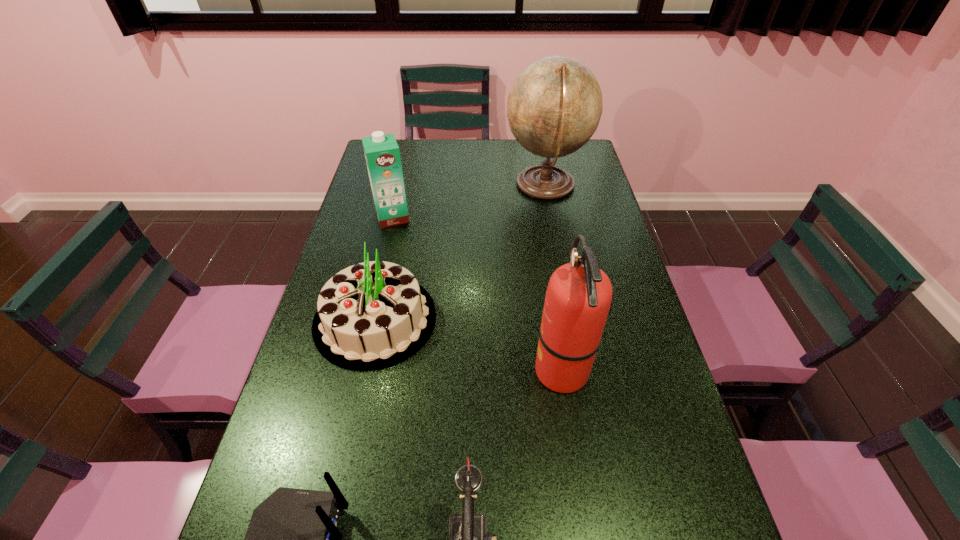
In the image, there is a desktop. What are the coordinates of `vacant space at the far left corner` in the screenshot? It's located at (404, 155).

The image size is (960, 540). Find the location of `free spot between the birthday cake and the globe`. free spot between the birthday cake and the globe is located at coordinates (461, 253).

The width and height of the screenshot is (960, 540). I want to click on unoccupied position between the globe and the third tallest object, so click(469, 201).

Identify the location of free space that is in between the fire extinguisher and the fourth shortest object. tap(477, 293).

Find the location of a particular element. This screenshot has height=540, width=960. object that stands as the second closest to the birthday cake is located at coordinates (578, 297).

Identify which object is the closest to the router. Please provide its 2D coordinates. Your answer should be formatted as a tuple, i.e. [(x, y)], where the tuple contains the x and y coordinates of a point satisfying the conditions above.

[(468, 538)]